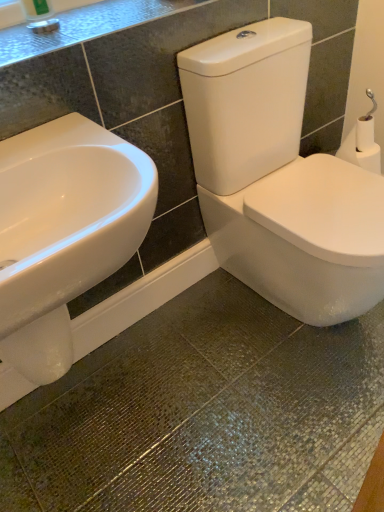
Question: Is point (59, 293) closer or farther from the camera than point (380, 157)?

Choices:
 (A) closer
 (B) farther

Answer: (A)

Question: Is white glossy sink at left situated inside white matte toilet paper at right or outside?

Choices:
 (A) outside
 (B) inside

Answer: (A)

Question: Which is farther from the white glossy sink at left?

Choices:
 (A) white matte toilet paper at right
 (B) granite countertop at upper left

Answer: (A)

Question: Estimate the real-world distances between objects in this image. Which object is closer to the granite countertop at upper left?

Choices:
 (A) white glossy sink at left
 (B) white matte toilet paper at right

Answer: (A)